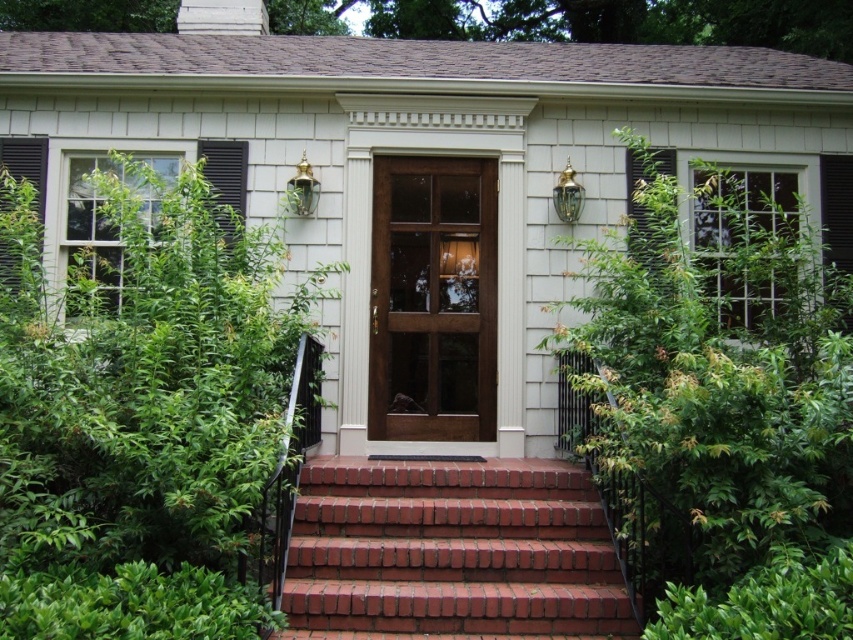
In the scene shown: You are a delivery person approaching the house and need to place a package at the base of the red brick stairs at center. However, there is a green leafy bush at right in the way. Can you move the package around the bush to reach the stairs?

The green leafy bush at right is in front of the red brick stairs at center, so you can move the package around the bush to reach the stairs by going around either side of the bush.

You are a delivery person arriving at the house entrance. You need to determine if the green leafy plant at left will block your path to the glossy wood door at center. Can you pass through without bending down?

The green leafy plant at left is taller than the glossy wood door at center, so it might block your path. You may need to bend down or move the plant to access the door safely.